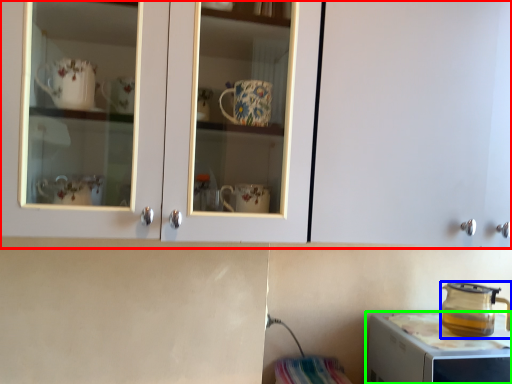
Question: Which object is the closest to the cabinetry (highlighted by a red box)? Choose among these: kitchen appliance (highlighted by a blue box) or home appliance (highlighted by a green box).

Choices:
 (A) kitchen appliance
 (B) home appliance

Answer: (B)